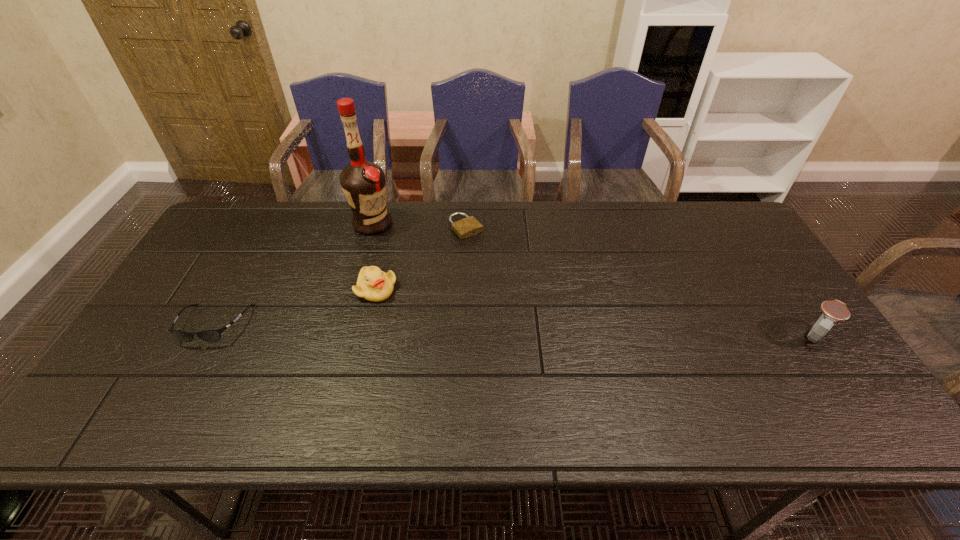
Where is `vacant space located on the left of the fourth shortest object`? This screenshot has width=960, height=540. vacant space located on the left of the fourth shortest object is located at coordinates (729, 336).

Locate an element on the screen. Image resolution: width=960 pixels, height=540 pixels. free space located 0.180m on the keyhole side of the shortest object is located at coordinates (507, 272).

Locate an element on the screen. The width and height of the screenshot is (960, 540). free spot located on the keyhole side of the shortest object is located at coordinates (509, 273).

Where is `vacant space situated 0.290m on the keyhole side of the shortest object`? This screenshot has height=540, width=960. vacant space situated 0.290m on the keyhole side of the shortest object is located at coordinates (529, 294).

Identify the location of blank space located on the front and back of the tallest object. This screenshot has height=540, width=960. (396, 258).

The width and height of the screenshot is (960, 540). Find the location of `vacant space positioned 0.080m on the front and back of the tallest object`. vacant space positioned 0.080m on the front and back of the tallest object is located at coordinates (390, 249).

In order to click on free space located 0.050m on the front and back of the tallest object in this screenshot , I will do `click(386, 244)`.

Identify the location of free space located at the face of the third nearest object. The height and width of the screenshot is (540, 960). (414, 313).

What are the coordinates of `vacant space situated at the face of the third nearest object` in the screenshot? It's located at (431, 323).

This screenshot has width=960, height=540. I want to click on blank space located 0.120m at the face of the third nearest object, so click(x=422, y=318).